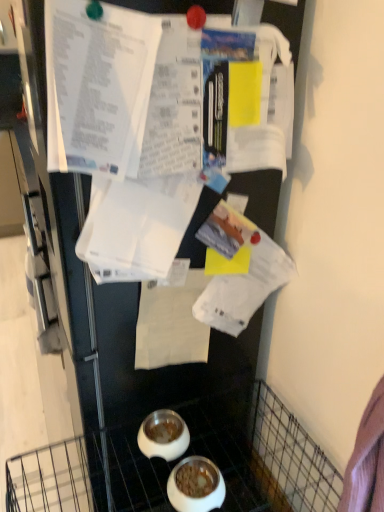
How much space does white glossy bowl at lower center, arranged as the 2th bowl when viewed from the back, occupy horizontally?

It is 6.18 inches.

Image resolution: width=384 pixels, height=512 pixels. Identify the location of white paper at center. (171, 324).

What do you see at coordinates (171, 324) in the screenshot? The image size is (384, 512). I see `white paper at center` at bounding box center [171, 324].

Where is `white glossy bowl at lower center, the 2th bowl from the front`? This screenshot has height=512, width=384. white glossy bowl at lower center, the 2th bowl from the front is located at coordinates (163, 435).

Where is `white glossy bowl at lower center, which ranks as the first bowl in front-to-back order`? white glossy bowl at lower center, which ranks as the first bowl in front-to-back order is located at coordinates (196, 485).

Is white glossy bowl at lower center, the 2th bowl from the front, wider or thinner than white paper at center?

In the image, white glossy bowl at lower center, the 2th bowl from the front, appears to be wider than white paper at center.

Is white glossy bowl at lower center, the 2th bowl from the front, behind white paper at center?

Yes, white glossy bowl at lower center, the 2th bowl from the front, is behind white paper at center.

Is the surface of white glossy bowl at lower center, the 1th bowl when ordered from back to front, in direct contact with white paper at center?

white glossy bowl at lower center, the 1th bowl when ordered from back to front, and white paper at center are clearly separated.

Does white glossy bowl at lower center, the 2th bowl from the front, contain white paper at center?

No.

Looking at the image, does white glossy bowl at lower center, which ranks as the first bowl in front-to-back order, seem bigger or smaller compared to white paper at center?

Clearly, white glossy bowl at lower center, which ranks as the first bowl in front-to-back order, is smaller in size than white paper at center.

How far apart are white glossy bowl at lower center, arranged as the 2th bowl when viewed from the back, and white paper at center?

white glossy bowl at lower center, arranged as the 2th bowl when viewed from the back, and white paper at center are 33.36 centimeters apart.

Considering the relative sizes of white glossy bowl at lower center, which ranks as the first bowl in front-to-back order, and white paper at center in the image provided, is white glossy bowl at lower center, which ranks as the first bowl in front-to-back order, taller than white paper at center?

Incorrect, the height of white glossy bowl at lower center, which ranks as the first bowl in front-to-back order, is not larger of that of white paper at center.

Visually, is white glossy bowl at lower center, arranged as the 2th bowl when viewed from the back, positioned to the left or to the right of white paper at center?

Based on their positions, white glossy bowl at lower center, arranged as the 2th bowl when viewed from the back, is located to the right of white paper at center.

Based on the photo, is white glossy bowl at lower center, the 1th bowl when ordered from back to front, oriented away from white glossy bowl at lower center, which ranks as the first bowl in front-to-back order?

white glossy bowl at lower center, the 1th bowl when ordered from back to front, is not turned away from white glossy bowl at lower center, which ranks as the first bowl in front-to-back order.

Is white glossy bowl at lower center, the 2th bowl from the front, bigger than white glossy bowl at lower center, arranged as the 2th bowl when viewed from the back?

Incorrect, white glossy bowl at lower center, the 2th bowl from the front, is not larger than white glossy bowl at lower center, arranged as the 2th bowl when viewed from the back.

Which point is more forward, (170, 411) or (193, 509)?

Positioned in front is point (193, 509).

In the image, is white glossy bowl at lower center, the 2th bowl from the front, on the left side or the right side of white glossy bowl at lower center, which ranks as the first bowl in front-to-back order?

From the image, it's evident that white glossy bowl at lower center, the 2th bowl from the front, is to the left of white glossy bowl at lower center, which ranks as the first bowl in front-to-back order.

Does white paper at center have a larger size compared to white glossy bowl at lower center, the 1th bowl when ordered from back to front?

Indeed, white paper at center has a larger size compared to white glossy bowl at lower center, the 1th bowl when ordered from back to front.

Would you say white paper at center contains white glossy bowl at lower center, the 2th bowl from the front?

No, white glossy bowl at lower center, the 2th bowl from the front, is not a part of white paper at center.

Is white paper at center turned away from white glossy bowl at lower center, the 2th bowl from the front?

No, white paper at center is not facing the opposite direction of white glossy bowl at lower center, the 2th bowl from the front.

Which of these two, white paper at center or white glossy bowl at lower center, the 2th bowl from the front, stands taller?

white paper at center is taller.

Find the location of a particular element. The width and height of the screenshot is (384, 512). bowl in front of the white glossy bowl at lower center, the 1th bowl when ordered from back to front is located at coordinates (196, 485).

From the picture: Does white glossy bowl at lower center, arranged as the 2th bowl when viewed from the back, appear on the right side of white glossy bowl at lower center, the 2th bowl from the front?

Correct, you'll find white glossy bowl at lower center, arranged as the 2th bowl when viewed from the back, to the right of white glossy bowl at lower center, the 2th bowl from the front.

From a real-world perspective, does white glossy bowl at lower center, which ranks as the first bowl in front-to-back order, sit lower than white glossy bowl at lower center, the 2th bowl from the front?

Yes, from a real-world perspective, white glossy bowl at lower center, which ranks as the first bowl in front-to-back order, is beneath white glossy bowl at lower center, the 2th bowl from the front.

Based on the photo, can you confirm if white paper at center is wider than white glossy bowl at lower center, arranged as the 2th bowl when viewed from the back?

Incorrect, the width of white paper at center does not surpass that of white glossy bowl at lower center, arranged as the 2th bowl when viewed from the back.

From a real-world perspective, which is physically below, white paper at center or white glossy bowl at lower center, arranged as the 2th bowl when viewed from the back?

white glossy bowl at lower center, arranged as the 2th bowl when viewed from the back.

Can you tell me how much white paper at center and white glossy bowl at lower center, arranged as the 2th bowl when viewed from the back, differ in facing direction?

white paper at center and white glossy bowl at lower center, arranged as the 2th bowl when viewed from the back, are facing 90.2 degrees away from each other.

Where is `paper above the white glossy bowl at lower center, the 1th bowl when ordered from back to front (from a real-world perspective)`? This screenshot has width=384, height=512. paper above the white glossy bowl at lower center, the 1th bowl when ordered from back to front (from a real-world perspective) is located at coordinates (171, 324).

At what (x,y) coordinates should I click in order to perform the action: click on paper that appears behind the white glossy bowl at lower center, which ranks as the first bowl in front-to-back order. Please return your answer as a coordinate pair (x, y). Looking at the image, I should click on (171, 324).

From the image, which object appears to be nearer to white glossy bowl at lower center, the 2th bowl from the front, white paper at center or white glossy bowl at lower center, which ranks as the first bowl in front-to-back order?

white glossy bowl at lower center, which ranks as the first bowl in front-to-back order, lies closer to white glossy bowl at lower center, the 2th bowl from the front, than the other object.

From the image, which object appears to be nearer to white glossy bowl at lower center, arranged as the 2th bowl when viewed from the back, white paper at center or white glossy bowl at lower center, the 1th bowl when ordered from back to front?

white glossy bowl at lower center, the 1th bowl when ordered from back to front, is closer to white glossy bowl at lower center, arranged as the 2th bowl when viewed from the back.

Based on their spatial positions, is white glossy bowl at lower center, arranged as the 2th bowl when viewed from the back, or white paper at center further from white glossy bowl at lower center, the 2th bowl from the front?

white paper at center.

Looking at the image, which one is located closer to white paper at center, white glossy bowl at lower center, the 2th bowl from the front, or white glossy bowl at lower center, arranged as the 2th bowl when viewed from the back?

The object closer to white paper at center is white glossy bowl at lower center, the 2th bowl from the front.

In the scene shown: Looking at the image, which one is located further to white paper at center, white glossy bowl at lower center, arranged as the 2th bowl when viewed from the back, or white glossy bowl at lower center, the 2th bowl from the front?

white glossy bowl at lower center, arranged as the 2th bowl when viewed from the back, is further to white paper at center.

Estimate the real-world distances between objects in this image. Which object is closer to white glossy bowl at lower center, arranged as the 2th bowl when viewed from the back, white glossy bowl at lower center, the 2th bowl from the front, or white paper at center?

The object closer to white glossy bowl at lower center, arranged as the 2th bowl when viewed from the back, is white glossy bowl at lower center, the 2th bowl from the front.

You are a GUI agent. You are given a task and a screenshot of the screen. Output one action in this format:
    pyautogui.click(x=<x>, y=<y>)
    Task: Click on the bowl between white paper at center and white glossy bowl at lower center, which ranks as the first bowl in front-to-back order, vertically
    
    Given the screenshot: What is the action you would take?
    pyautogui.click(x=163, y=435)